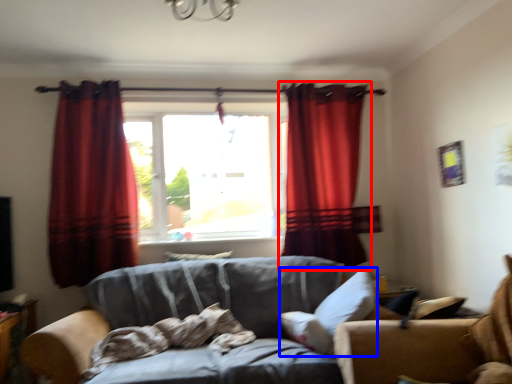
Question: Which object appears closest to the camera in this image, curtain (highlighted by a red box) or pillow (highlighted by a blue box)?

Choices:
 (A) curtain
 (B) pillow

Answer: (B)